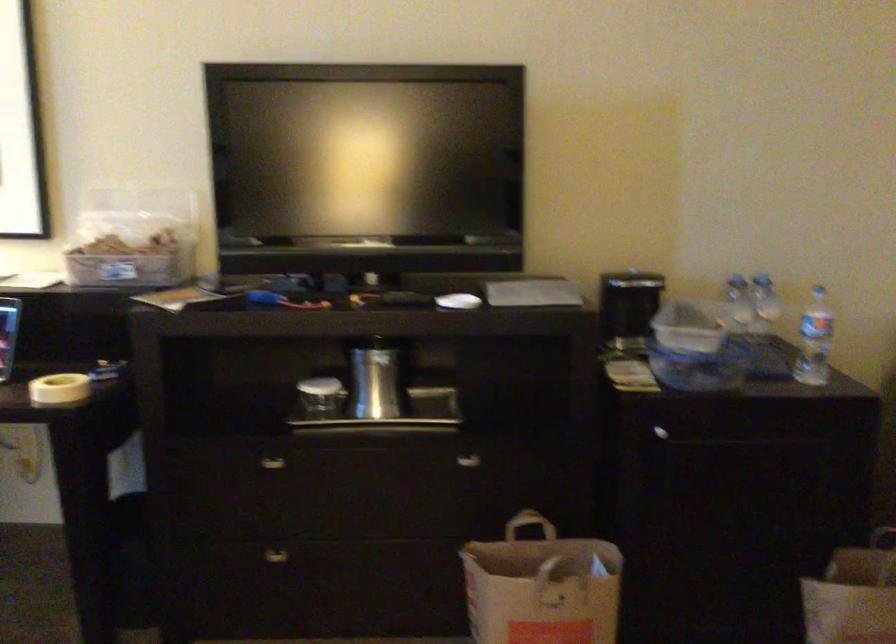
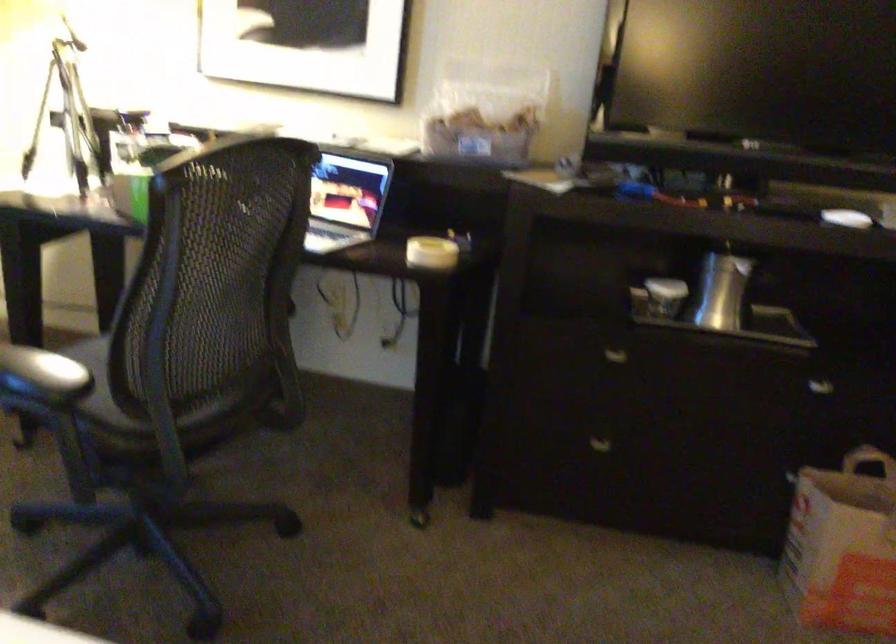
The point at (276, 468) is marked in the first image. Where is the corresponding point in the second image?

(615, 357)